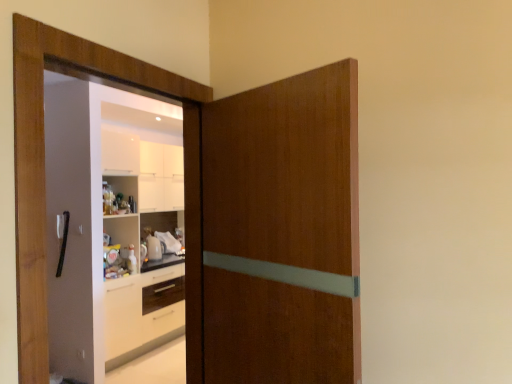
Question: Should I look upward or downward to see wooden screen door at left?

Choices:
 (A) up
 (B) down

Answer: (B)

Question: Is wooden door at center located within black plastic door handle at left?

Choices:
 (A) yes
 (B) no

Answer: (B)

Question: Does black plastic door handle at left come in front of wooden door at center?

Choices:
 (A) yes
 (B) no

Answer: (B)

Question: Does black plastic door handle at left have a lesser height compared to wooden door at center?

Choices:
 (A) no
 (B) yes

Answer: (B)

Question: Can you confirm if black plastic door handle at left is positioned to the right of wooden door at center?

Choices:
 (A) no
 (B) yes

Answer: (A)

Question: Is black plastic door handle at left not near wooden door at center?

Choices:
 (A) yes
 (B) no

Answer: (A)

Question: Does black plastic door handle at left have a larger size compared to wooden door at center?

Choices:
 (A) no
 (B) yes

Answer: (A)

Question: Is wooden door at center shorter than black plastic door handle at left?

Choices:
 (A) yes
 (B) no

Answer: (B)

Question: Is wooden door at center completely or partially outside of black plastic door handle at left?

Choices:
 (A) yes
 (B) no

Answer: (A)

Question: Considering the relative positions of wooden door at center and black plastic door handle at left in the image provided, is wooden door at center to the left of black plastic door handle at left from the viewer's perspective?

Choices:
 (A) no
 (B) yes

Answer: (A)

Question: From a real-world perspective, does wooden door at center sit lower than black plastic door handle at left?

Choices:
 (A) yes
 (B) no

Answer: (B)

Question: Does wooden door at center have a greater height compared to black plastic door handle at left?

Choices:
 (A) no
 (B) yes

Answer: (B)

Question: Does wooden door at center touch black plastic door handle at left?

Choices:
 (A) yes
 (B) no

Answer: (B)

Question: Is black plastic door handle at left smaller than wooden screen door at left?

Choices:
 (A) yes
 (B) no

Answer: (A)